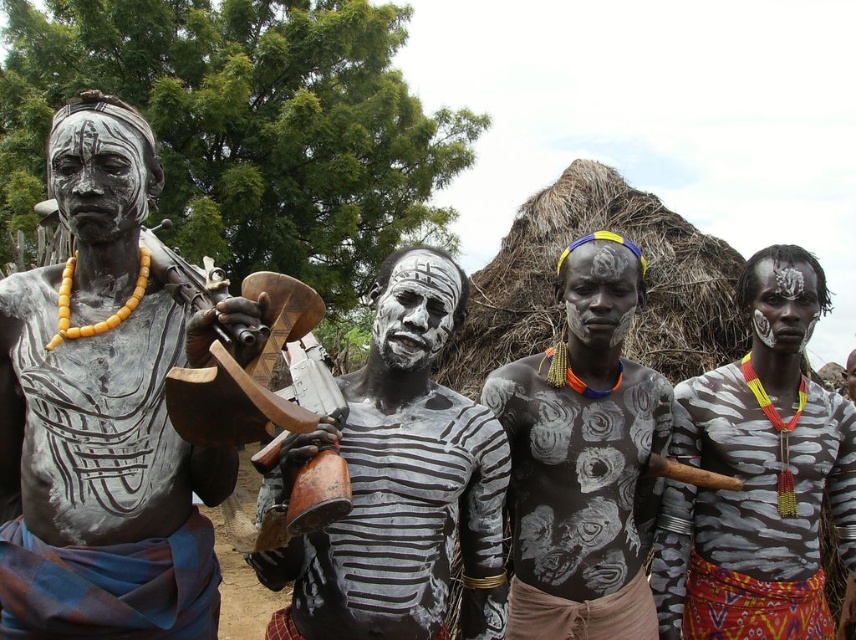
You are standing in front of the traditional hut and notice two points marked in the scene. The first point is at coordinate point(x=188, y=605) and the second is at point(x=489, y=621). Which point is closer to you?

Point(x=188, y=605) is closer to the viewer than point(x=489, y=621).

You are a photographer standing at the matte black statue at left and want to take a photo of the white painted body at center. Considering the distance between them, can you capture the entire scene in one frame without moving your position?

The distance between the matte black statue at left and white painted body at center is 3.61 meters. Since you are at the statue, the white painted body at center is 3.61 meters away. Whether you can capture the entire scene depends on your camera lens. A standard lens might require moving closer, but a wide angle lens could potentially include both subjects in one frame without moving.